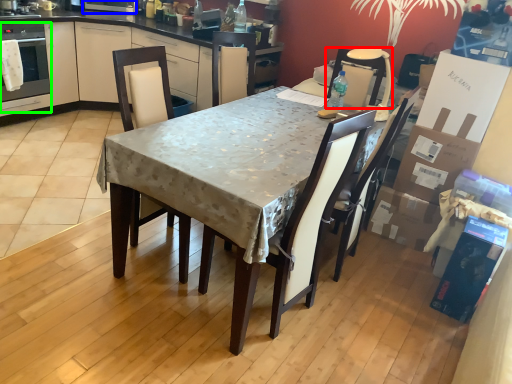
Question: Which is farther away from chair (highlighted by a red box)? appliance (highlighted by a blue box) or oven (highlighted by a green box)?

Choices:
 (A) appliance
 (B) oven

Answer: (B)